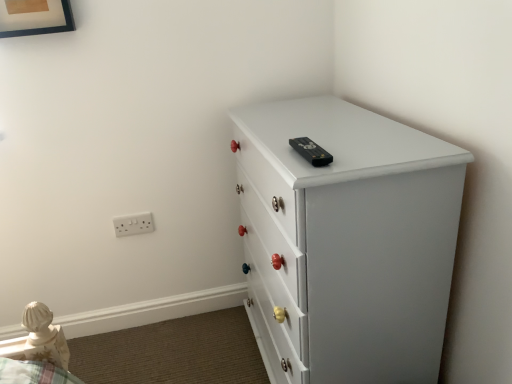
Question: Considering the relative sizes of wooden picture frame at upper left and white plastic electric outlet at lower left in the image provided, is wooden picture frame at upper left bigger than white plastic electric outlet at lower left?

Choices:
 (A) yes
 (B) no

Answer: (A)

Question: Does wooden picture frame at upper left have a smaller size compared to white plastic electric outlet at lower left?

Choices:
 (A) yes
 (B) no

Answer: (B)

Question: Can you confirm if wooden picture frame at upper left is thinner than white plastic electric outlet at lower left?

Choices:
 (A) yes
 (B) no

Answer: (B)

Question: From a real-world perspective, is wooden picture frame at upper left positioned under white plastic electric outlet at lower left based on gravity?

Choices:
 (A) yes
 (B) no

Answer: (B)

Question: Is wooden picture frame at upper left positioned in front of white plastic electric outlet at lower left?

Choices:
 (A) yes
 (B) no

Answer: (A)

Question: Does wooden picture frame at upper left appear on the right side of white plastic electric outlet at lower left?

Choices:
 (A) yes
 (B) no

Answer: (B)

Question: Does white painted wood chest of drawers at upper right appear on the right side of wooden picture frame at upper left?

Choices:
 (A) yes
 (B) no

Answer: (A)

Question: From the image's perspective, is white painted wood chest of drawers at upper right located beneath wooden picture frame at upper left?

Choices:
 (A) no
 (B) yes

Answer: (B)

Question: Is white painted wood chest of drawers at upper right not near wooden picture frame at upper left?

Choices:
 (A) no
 (B) yes

Answer: (B)

Question: Can you confirm if white painted wood chest of drawers at upper right is wider than wooden picture frame at upper left?

Choices:
 (A) no
 (B) yes

Answer: (B)

Question: Does white painted wood chest of drawers at upper right have a lesser width compared to wooden picture frame at upper left?

Choices:
 (A) yes
 (B) no

Answer: (B)

Question: From a real-world perspective, is white painted wood chest of drawers at upper right below wooden picture frame at upper left?

Choices:
 (A) yes
 (B) no

Answer: (A)

Question: Is white plastic electric outlet at lower left outside of white painted wood chest of drawers at upper right?

Choices:
 (A) yes
 (B) no

Answer: (A)